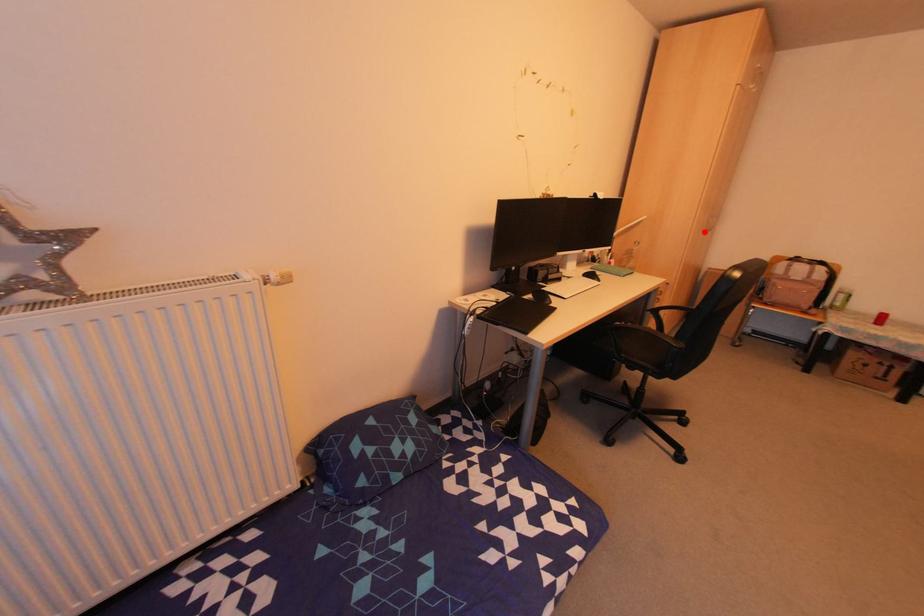
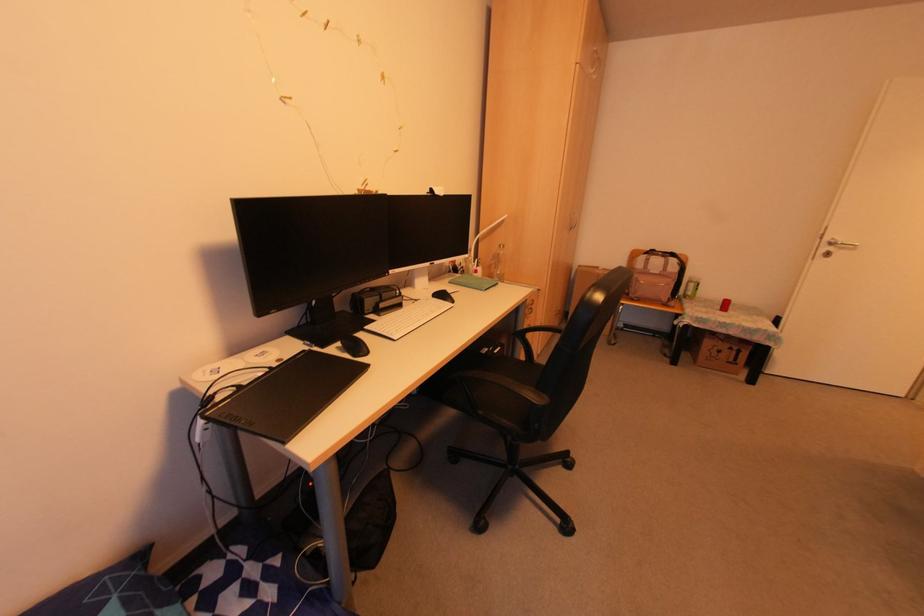
Find the pixel in the second image that matches the highlighted location in the first image.

(568, 229)